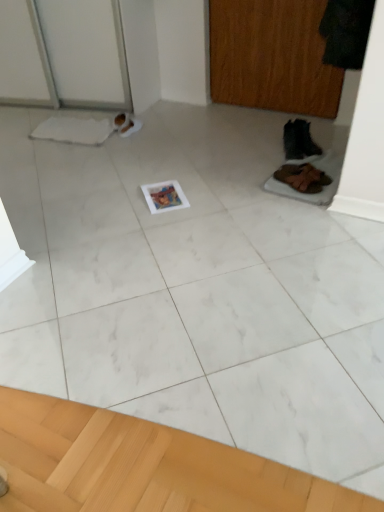
Image resolution: width=384 pixels, height=512 pixels. Describe the element at coordinates (299, 140) in the screenshot. I see `black leather boot at right, marked as the 2th footwear in a front-to-back arrangement` at that location.

What do you see at coordinates (302, 177) in the screenshot? The image size is (384, 512). I see `brown suede shoes at lower right, which appears as the second footwear when viewed from the top` at bounding box center [302, 177].

At what (x,y) coordinates should I click in order to perform the action: click on wooden screen door at upper right. Please return your answer as a coordinate pair (x, y). The height and width of the screenshot is (512, 384). Looking at the image, I should click on (272, 57).

This screenshot has height=512, width=384. What are the coordinates of `black leather boot at right, the second footwear when ordered from bottom to top` in the screenshot? It's located at (299, 140).

Is brown suede shoes at lower right, which appears as the second footwear when viewed from the top, not near wooden screen door at upper right?

brown suede shoes at lower right, which appears as the second footwear when viewed from the top, is actually quite close to wooden screen door at upper right.

Is wooden screen door at upper right a part of brown suede shoes at lower right, the second footwear viewed from the back?

No.

Is brown suede shoes at lower right, the second footwear viewed from the back, facing away from wooden screen door at upper right?

That's not correct — brown suede shoes at lower right, the second footwear viewed from the back, is not looking away from wooden screen door at upper right.

Locate an element on the screen. This screenshot has height=512, width=384. screen door behind the brown suede shoes at lower right, the second footwear viewed from the back is located at coordinates (272, 57).

At what (x,y) coordinates should I click in order to perform the action: click on the 1st footwear counting from the right of the wooden screen door at upper right. Please return your answer as a coordinate pair (x, y). Looking at the image, I should click on (302, 177).

Is wooden screen door at upper right to the left of brown suede shoes at lower right, placed as the first footwear when sorted from bottom to top, from the viewer's perspective?

Correct, you'll find wooden screen door at upper right to the left of brown suede shoes at lower right, placed as the first footwear when sorted from bottom to top.

Which point is more distant from viewer, (255, 98) or (286, 183)?

The point (255, 98) is farther.

I want to click on screen door on the left of black leather boot at right, marked as the 2th footwear in a front-to-back arrangement, so click(272, 57).

Considering the relative positions of black leather boot at right, the 1th footwear viewed from the top, and wooden screen door at upper right in the image provided, is black leather boot at right, the 1th footwear viewed from the top, to the left or to the right of wooden screen door at upper right?

Clearly, black leather boot at right, the 1th footwear viewed from the top, is on the right of wooden screen door at upper right in the image.

Looking at their sizes, would you say black leather boot at right, marked as the 2th footwear in a front-to-back arrangement, is wider or thinner than wooden screen door at upper right?

Considering their sizes, black leather boot at right, marked as the 2th footwear in a front-to-back arrangement, looks broader than wooden screen door at upper right.

Is black leather boot at right, the second footwear when ordered from bottom to top, oriented towards wooden screen door at upper right?

Yes, black leather boot at right, the second footwear when ordered from bottom to top, is oriented towards wooden screen door at upper right.

Is black leather boot at right, the second footwear when ordered from bottom to top, facing towards brown suede shoes at lower right, the first footwear viewed from the front?

No, black leather boot at right, the second footwear when ordered from bottom to top, is not facing towards brown suede shoes at lower right, the first footwear viewed from the front.

Locate an element on the screen. footwear located on the left of black leather boot at right, the second footwear when ordered from bottom to top is located at coordinates (302, 177).

Does point (324, 185) come farther from viewer compared to point (295, 124)?

No, (324, 185) is closer to viewer.

Who is shorter, brown suede shoes at lower right, the first footwear viewed from the front, or black leather boot at right, marked as the 2th footwear in a front-to-back arrangement?

brown suede shoes at lower right, the first footwear viewed from the front.

Is brown suede shoes at lower right, placed as the first footwear when sorted from bottom to top, inside or outside of black leather boot at right, the first footwear in the back-to-front sequence?

brown suede shoes at lower right, placed as the first footwear when sorted from bottom to top, is spatially situated outside black leather boot at right, the first footwear in the back-to-front sequence.

The height and width of the screenshot is (512, 384). In order to click on footwear that is on the left side of black leather boot at right, the first footwear in the back-to-front sequence in this screenshot , I will do click(x=302, y=177).

Between wooden screen door at upper right and black leather boot at right, the first footwear in the back-to-front sequence, which one is positioned behind?

wooden screen door at upper right is further away from the camera.

Considering the sizes of wooden screen door at upper right and black leather boot at right, marked as the 2th footwear in a front-to-back arrangement, in the image, is wooden screen door at upper right bigger or smaller than black leather boot at right, marked as the 2th footwear in a front-to-back arrangement,?

Clearly, wooden screen door at upper right is larger in size than black leather boot at right, marked as the 2th footwear in a front-to-back arrangement.

From a real-world perspective, is wooden screen door at upper right physically located above or below black leather boot at right, the first footwear in the back-to-front sequence?

In terms of real-world spatial position, wooden screen door at upper right is above black leather boot at right, the first footwear in the back-to-front sequence.

From the wooden screen door at upper right, count 1st footwear to the right and point to it. Please provide its 2D coordinates.

[(302, 177)]

The height and width of the screenshot is (512, 384). I want to click on screen door above the brown suede shoes at lower right, which appears as the second footwear when viewed from the top (from the image's perspective), so click(272, 57).

Looking at the image, which one is located closer to brown suede shoes at lower right, the second footwear viewed from the back, wooden screen door at upper right or black leather boot at right, marked as the 2th footwear in a front-to-back arrangement?

black leather boot at right, marked as the 2th footwear in a front-to-back arrangement, is positioned closer to the anchor brown suede shoes at lower right, the second footwear viewed from the back.

Which object lies nearer to the anchor point brown suede shoes at lower right, placed as the first footwear when sorted from bottom to top, black leather boot at right, the second footwear when ordered from bottom to top, or wooden screen door at upper right?

black leather boot at right, the second footwear when ordered from bottom to top, is positioned closer to the anchor brown suede shoes at lower right, placed as the first footwear when sorted from bottom to top.

From the image, which object appears to be farther from wooden screen door at upper right, brown suede shoes at lower right, the first footwear viewed from the front, or black leather boot at right, the first footwear in the back-to-front sequence?

brown suede shoes at lower right, the first footwear viewed from the front, is positioned further to the anchor wooden screen door at upper right.

Looking at the image, which one is located closer to black leather boot at right, marked as the 2th footwear in a front-to-back arrangement, wooden screen door at upper right or brown suede shoes at lower right, the first footwear viewed from the front?

brown suede shoes at lower right, the first footwear viewed from the front, lies closer to black leather boot at right, marked as the 2th footwear in a front-to-back arrangement, than the other object.

Estimate the real-world distances between objects in this image. Which object is closer to wooden screen door at upper right, black leather boot at right, the second footwear when ordered from bottom to top, or brown suede shoes at lower right, which appears as the second footwear when viewed from the top?

Among the two, black leather boot at right, the second footwear when ordered from bottom to top, is located nearer to wooden screen door at upper right.

From the picture: Estimate the real-world distances between objects in this image. Which object is further from black leather boot at right, the 1th footwear viewed from the top, brown suede shoes at lower right, placed as the first footwear when sorted from bottom to top, or wooden screen door at upper right?

Based on the image, wooden screen door at upper right appears to be further to black leather boot at right, the 1th footwear viewed from the top.

Locate an element on the screen. footwear between wooden screen door at upper right and brown suede shoes at lower right, which appears as the second footwear when viewed from the top, vertically is located at coordinates (299, 140).